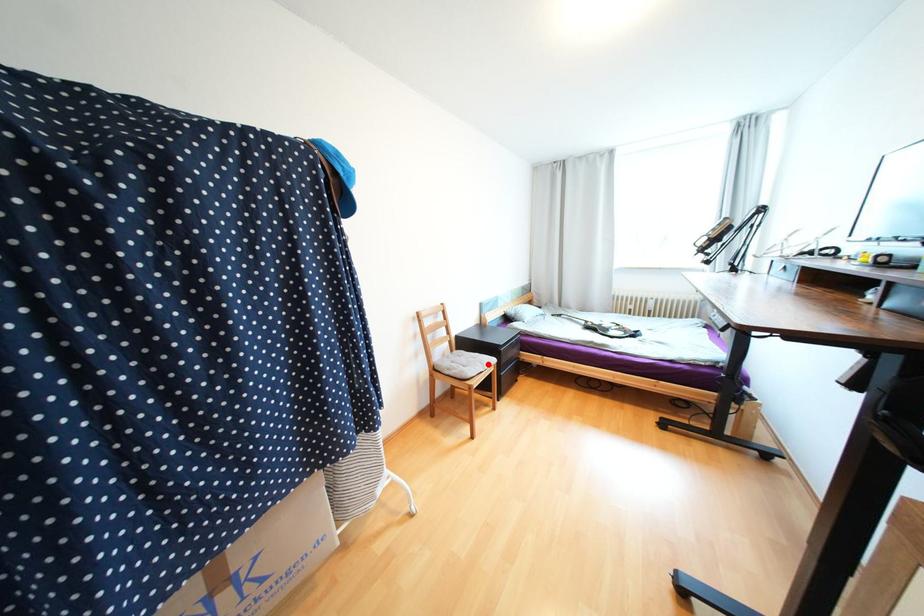
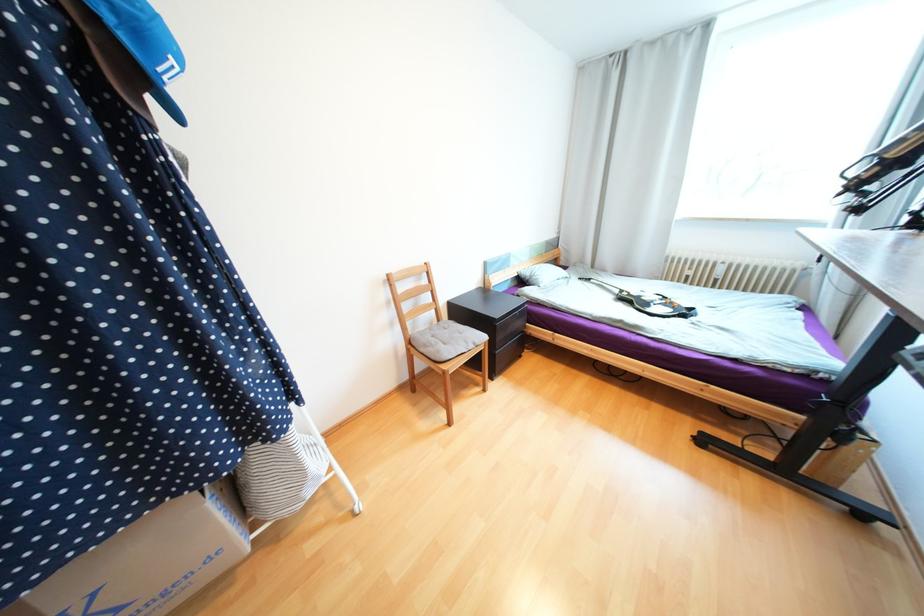
Where in the second image is the point corresponding to the highlighted location from the first image?

(472, 342)